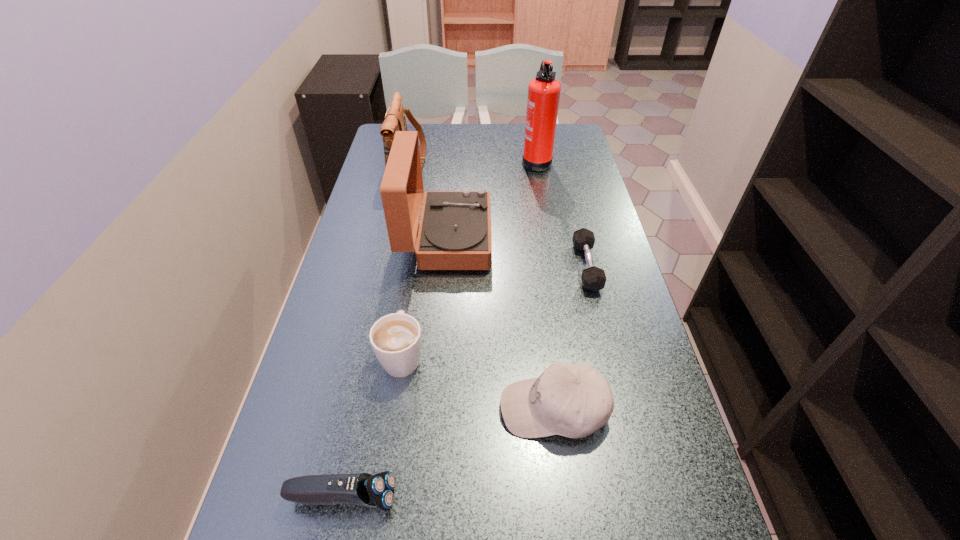
Image resolution: width=960 pixels, height=540 pixels. Identify the location of free point located on the head of the nearest object. (471, 497).

Where is `vacant region located on the front of the rightmost object`? The height and width of the screenshot is (540, 960). vacant region located on the front of the rightmost object is located at coordinates (627, 430).

Where is `fire extinguisher positioned at the far edge`? The width and height of the screenshot is (960, 540). fire extinguisher positioned at the far edge is located at coordinates (543, 91).

At what (x,y) coordinates should I click in order to perform the action: click on shoulder bag at the far edge. Please return your answer as a coordinate pair (x, y). This screenshot has height=540, width=960. Looking at the image, I should click on (395, 120).

Where is `phonograph record that is at the left edge`? The image size is (960, 540). phonograph record that is at the left edge is located at coordinates (454, 233).

The image size is (960, 540). What are the coordinates of `shoulder bag positioned at the left edge` in the screenshot? It's located at (395, 120).

The height and width of the screenshot is (540, 960). In order to click on cappuccino at the left edge in this screenshot , I will do `click(396, 339)`.

What are the coordinates of `electric shaver that is at the left edge` in the screenshot? It's located at (363, 489).

Locate an element on the screen. The width and height of the screenshot is (960, 540). fire extinguisher that is at the right edge is located at coordinates (543, 91).

Find the location of a particular element. This screenshot has width=960, height=540. baseball cap present at the right edge is located at coordinates (572, 400).